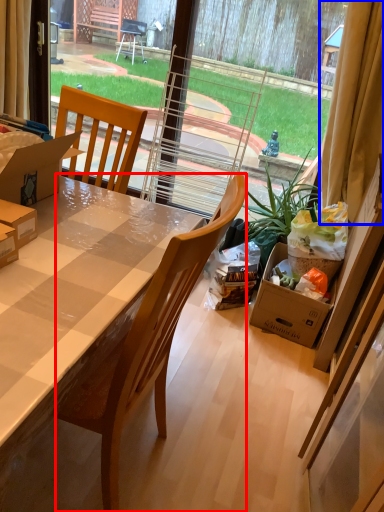
Question: Which of the following is the farthest to the observer, chair (highlighted by a red box) or curtain (highlighted by a blue box)?

Choices:
 (A) chair
 (B) curtain

Answer: (B)